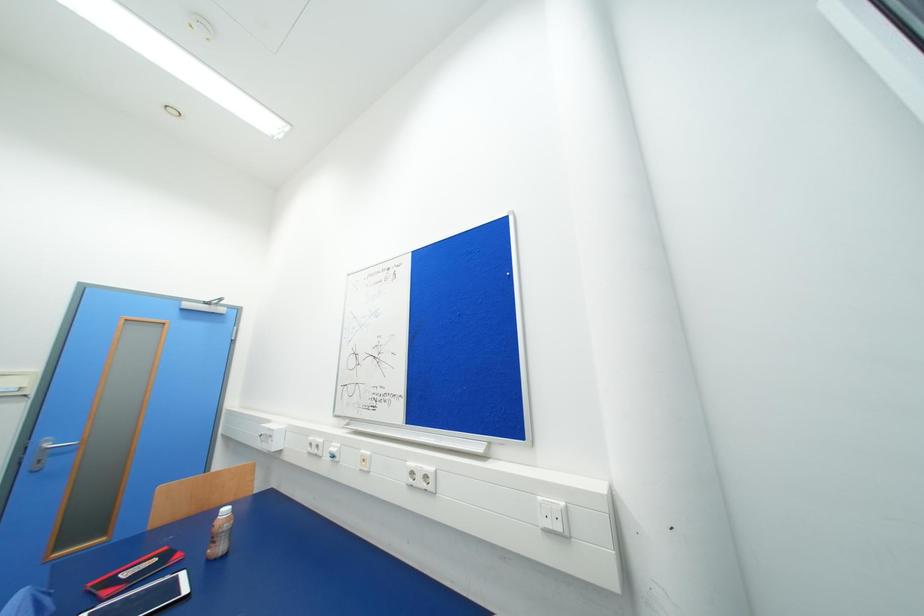
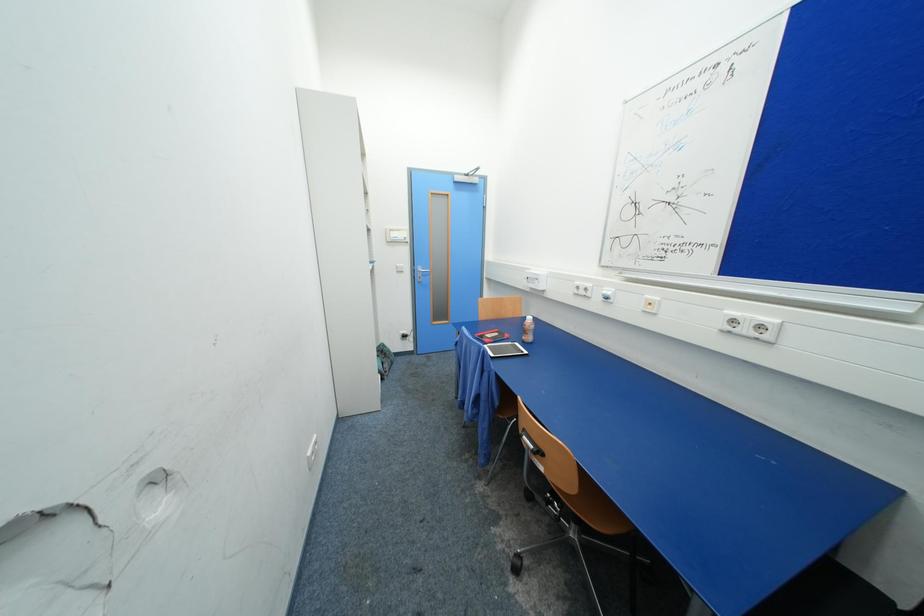
First-person continuous shooting, in which direction is the camera rotating?

The camera's rotation is toward left-down.